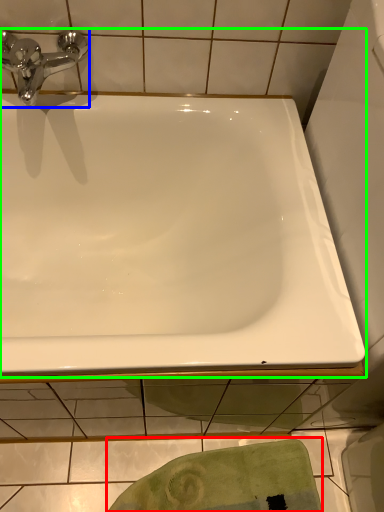
Question: Which is nearer to the bath towel (highlighted by a red box)? tap (highlighted by a blue box) or bathtub (highlighted by a green box).

Choices:
 (A) tap
 (B) bathtub

Answer: (B)